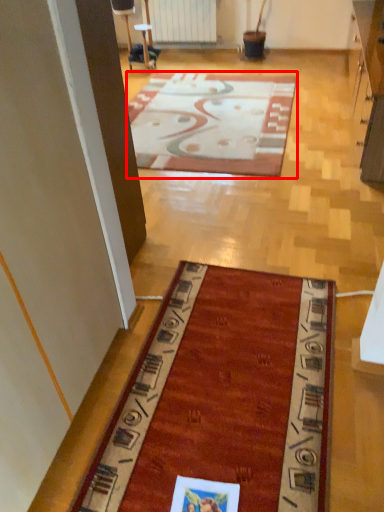
Question: From the image's perspective, what is the correct spatial positioning of mat (annotated by the red box) in reference to radiator?

Choices:
 (A) below
 (B) above

Answer: (A)